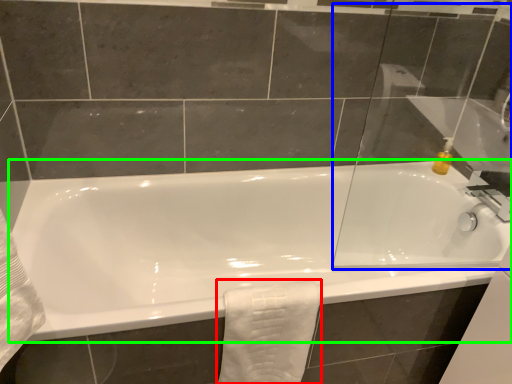
Question: Based on their relative distances, which object is nearer to bath towel (highlighted by a red box)? Choose from glass door (highlighted by a blue box) and bathtub (highlighted by a green box).

Choices:
 (A) glass door
 (B) bathtub

Answer: (B)